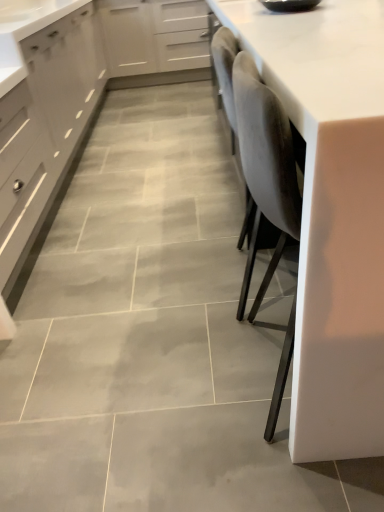
Measure the distance between point (322,152) and camera.

Point (322,152) and camera are 64.30 centimeters apart.

What do you see at coordinates (22, 180) in the screenshot? I see `matte gray drawer at left` at bounding box center [22, 180].

How much space does white matte cabinet at upper center, the first cabinetry viewed from the right, occupy horizontally?

The width of white matte cabinet at upper center, the first cabinetry viewed from the right, is 62.34 centimeters.

Locate an element on the screen. matte gray cabinet at left, which ranks as the 1th cabinetry in left-to-right order is located at coordinates (43, 115).

Can you confirm if white glossy countertop at right is wider than matte gray drawer at left?

Yes.

Is white glossy countertop at right in contact with matte gray drawer at left?

No, white glossy countertop at right is not with matte gray drawer at left.

How far apart are white glossy countertop at right and matte gray drawer at left?

A distance of 1.36 meters exists between white glossy countertop at right and matte gray drawer at left.

Do you think white glossy countertop at right is within matte gray drawer at left, or outside of it?

white glossy countertop at right exists outside the volume of matte gray drawer at left.

Is white glossy countertop at right aimed at white matte cabinet at upper center, which ranks as the second cabinetry in left-to-right order?

No, white glossy countertop at right is not oriented towards white matte cabinet at upper center, which ranks as the second cabinetry in left-to-right order.

Can you confirm if white glossy countertop at right is smaller than white matte cabinet at upper center, which ranks as the second cabinetry in left-to-right order?

Incorrect, white glossy countertop at right is not smaller in size than white matte cabinet at upper center, which ranks as the second cabinetry in left-to-right order.

Looking at this image, from a real-world perspective, which object stands above the other?

From a 3D spatial view, white glossy countertop at right is above.

This screenshot has width=384, height=512. In order to click on countertop in front of the white matte cabinet at upper center, the first cabinetry viewed from the right in this screenshot , I will do `click(332, 213)`.

Can you tell me how much white glossy countertop at right and matte gray cabinet at left, which ranks as the 1th cabinetry in left-to-right order, differ in facing direction?

white glossy countertop at right and matte gray cabinet at left, which ranks as the 1th cabinetry in left-to-right order, are facing 90.6 degrees away from each other.

Choose the correct answer: Is white glossy countertop at right inside matte gray cabinet at left, acting as the second cabinetry starting from the right, or outside it?

white glossy countertop at right is outside matte gray cabinet at left, acting as the second cabinetry starting from the right.

Does white glossy countertop at right touch matte gray cabinet at left, which ranks as the 1th cabinetry in left-to-right order?

They are not placed beside each other.

Identify the location of countertop lying on the right of matte gray cabinet at left, acting as the second cabinetry starting from the right. The width and height of the screenshot is (384, 512). (332, 213).

Does matte gray drawer at left have a greater width compared to white glossy countertop at right?

In fact, matte gray drawer at left might be narrower than white glossy countertop at right.

In the image, is matte gray drawer at left positioned in front of or behind white glossy countertop at right?

In the image, matte gray drawer at left appears behind white glossy countertop at right.

Does matte gray drawer at left turn towards white glossy countertop at right?

Yes, matte gray drawer at left is facing white glossy countertop at right.

Is matte gray drawer at left inside the boundaries of white glossy countertop at right, or outside?

matte gray drawer at left is located beyond the bounds of white glossy countertop at right.

Is matte gray drawer at left facing towards matte gray cabinet at left, acting as the second cabinetry starting from the right?

No.

From a real-world perspective, which is physically above, matte gray drawer at left or matte gray cabinet at left, which ranks as the 1th cabinetry in left-to-right order?

matte gray cabinet at left, which ranks as the 1th cabinetry in left-to-right order.

How many degrees apart are the facing directions of matte gray drawer at left and matte gray cabinet at left, which ranks as the 1th cabinetry in left-to-right order?

0.124 degrees.

Can you confirm if matte gray drawer at left is smaller than matte gray cabinet at left, which ranks as the 1th cabinetry in left-to-right order?

Yes, matte gray drawer at left is smaller than matte gray cabinet at left, which ranks as the 1th cabinetry in left-to-right order.

Identify the location of drawer below the white matte cabinet at upper center, the first cabinetry viewed from the right (from the image's perspective). This screenshot has height=512, width=384. (22, 180).

From a real-world perspective, is matte gray drawer at left located higher than white matte cabinet at upper center, the first cabinetry viewed from the right?

Incorrect, from a real-world perspective, matte gray drawer at left is lower than white matte cabinet at upper center, the first cabinetry viewed from the right.

Could you tell me if matte gray drawer at left is turned towards white matte cabinet at upper center, the first cabinetry viewed from the right?

No, matte gray drawer at left is not oriented towards white matte cabinet at upper center, the first cabinetry viewed from the right.

Consider the image. Considering the relative sizes of matte gray drawer at left and white matte cabinet at upper center, which ranks as the second cabinetry in left-to-right order, in the image provided, is matte gray drawer at left wider than white matte cabinet at upper center, which ranks as the second cabinetry in left-to-right order,?

No, matte gray drawer at left is not wider than white matte cabinet at upper center, which ranks as the second cabinetry in left-to-right order.

Is white matte cabinet at upper center, the first cabinetry viewed from the right, taller or shorter than white glossy countertop at right?

Clearly, white matte cabinet at upper center, the first cabinetry viewed from the right, is shorter compared to white glossy countertop at right.

Is white matte cabinet at upper center, the first cabinetry viewed from the right, positioned far away from white glossy countertop at right?

white matte cabinet at upper center, the first cabinetry viewed from the right, is far away from white glossy countertop at right.

Considering the positions of objects white matte cabinet at upper center, which ranks as the second cabinetry in left-to-right order, and white glossy countertop at right in the image provided, who is more to the left, white matte cabinet at upper center, which ranks as the second cabinetry in left-to-right order, or white glossy countertop at right?

white matte cabinet at upper center, which ranks as the second cabinetry in left-to-right order, is more to the left.

Is white matte cabinet at upper center, which ranks as the second cabinetry in left-to-right order, inside the boundaries of white glossy countertop at right, or outside?

white matte cabinet at upper center, which ranks as the second cabinetry in left-to-right order, is not inside white glossy countertop at right, it's outside.

There is a matte gray drawer at left. Where is `countertop above it (from a real-world perspective)`? countertop above it (from a real-world perspective) is located at coordinates (332, 213).

You are a GUI agent. You are given a task and a screenshot of the screen. Output one action in this format:
    pyautogui.click(x=<x>, y=<y>)
    Task: Click on the cabinetry below the white glossy countertop at right (from a real-world perspective)
    This screenshot has width=384, height=512.
    Given the screenshot: What is the action you would take?
    pyautogui.click(x=154, y=35)

Looking at the image, which one is located closer to white matte cabinet at upper center, the first cabinetry viewed from the right, white glossy countertop at right or matte gray drawer at left?

→ Among the two, matte gray drawer at left is located nearer to white matte cabinet at upper center, the first cabinetry viewed from the right.

Which object lies further to the anchor point matte gray drawer at left, white matte cabinet at upper center, the first cabinetry viewed from the right, or matte gray cabinet at left, which ranks as the 1th cabinetry in left-to-right order?

white matte cabinet at upper center, the first cabinetry viewed from the right, is positioned further to the anchor matte gray drawer at left.

Looking at the image, which one is located closer to matte gray drawer at left, matte gray cabinet at left, acting as the second cabinetry starting from the right, or white glossy countertop at right?

matte gray cabinet at left, acting as the second cabinetry starting from the right, is closer to matte gray drawer at left.

Consider the image. When comparing their distances from white matte cabinet at upper center, the first cabinetry viewed from the right, does matte gray drawer at left or white glossy countertop at right seem closer?

Based on the image, matte gray drawer at left appears to be nearer to white matte cabinet at upper center, the first cabinetry viewed from the right.

Which object lies nearer to the anchor point matte gray drawer at left, white glossy countertop at right or matte gray cabinet at left, acting as the second cabinetry starting from the right?

matte gray cabinet at left, acting as the second cabinetry starting from the right, lies closer to matte gray drawer at left than the other object.

Estimate the real-world distances between objects in this image. Which object is further from matte gray drawer at left, white glossy countertop at right or white matte cabinet at upper center, the first cabinetry viewed from the right?

Based on the image, white matte cabinet at upper center, the first cabinetry viewed from the right, appears to be further to matte gray drawer at left.

Looking at the image, which one is located further to white matte cabinet at upper center, which ranks as the second cabinetry in left-to-right order, matte gray drawer at left or matte gray cabinet at left, which ranks as the 1th cabinetry in left-to-right order?

matte gray drawer at left lies further to white matte cabinet at upper center, which ranks as the second cabinetry in left-to-right order, than the other object.

From the image, which object appears to be farther from white glossy countertop at right, matte gray drawer at left or matte gray cabinet at left, which ranks as the 1th cabinetry in left-to-right order?

The object further to white glossy countertop at right is matte gray cabinet at left, which ranks as the 1th cabinetry in left-to-right order.

The height and width of the screenshot is (512, 384). What are the coordinates of `drawer between white glossy countertop at right and white matte cabinet at upper center, the first cabinetry viewed from the right, from front to back` in the screenshot? It's located at (22, 180).

I want to click on cabinetry positioned between matte gray drawer at left and white matte cabinet at upper center, which ranks as the second cabinetry in left-to-right order, from near to far, so click(43, 115).

This screenshot has height=512, width=384. I want to click on drawer located between matte gray cabinet at left, which ranks as the 1th cabinetry in left-to-right order, and white glossy countertop at right in the left-right direction, so click(22, 180).

Locate an element on the screen. The image size is (384, 512). cabinetry between white glossy countertop at right and white matte cabinet at upper center, which ranks as the second cabinetry in left-to-right order, in the front-back direction is located at coordinates (43, 115).